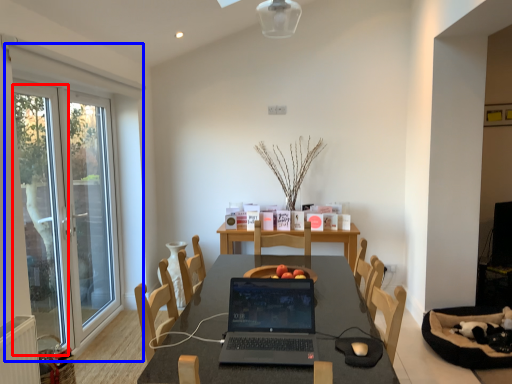
Question: Among these objects, which one is farthest to the camera, screen door (highlighted by a red box) or window (highlighted by a blue box)?

Choices:
 (A) screen door
 (B) window

Answer: (B)